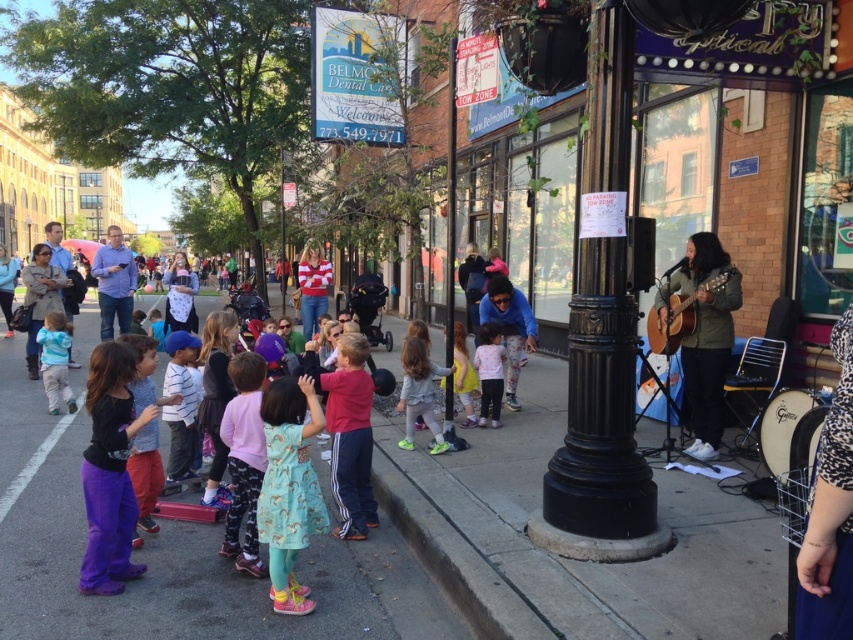
You are a fashion designer observing a street scene. You notice two people wearing purple cotton pants at lower left and green matte jacket at right. Which clothing item is narrower?

The purple cotton pants at lower left are narrower than the green matte jacket at right.